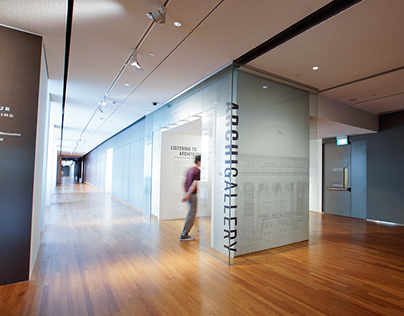
This screenshot has height=316, width=404. I want to click on window, so click(x=344, y=179).